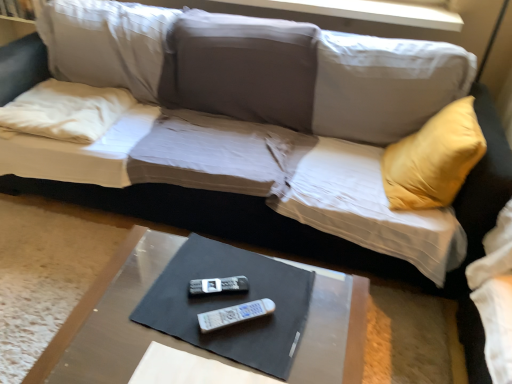
This screenshot has height=384, width=512. Find the location of `vacant space to the right of black plastic remote at center, the second remote when ordered from bottom to top`. vacant space to the right of black plastic remote at center, the second remote when ordered from bottom to top is located at coordinates (281, 295).